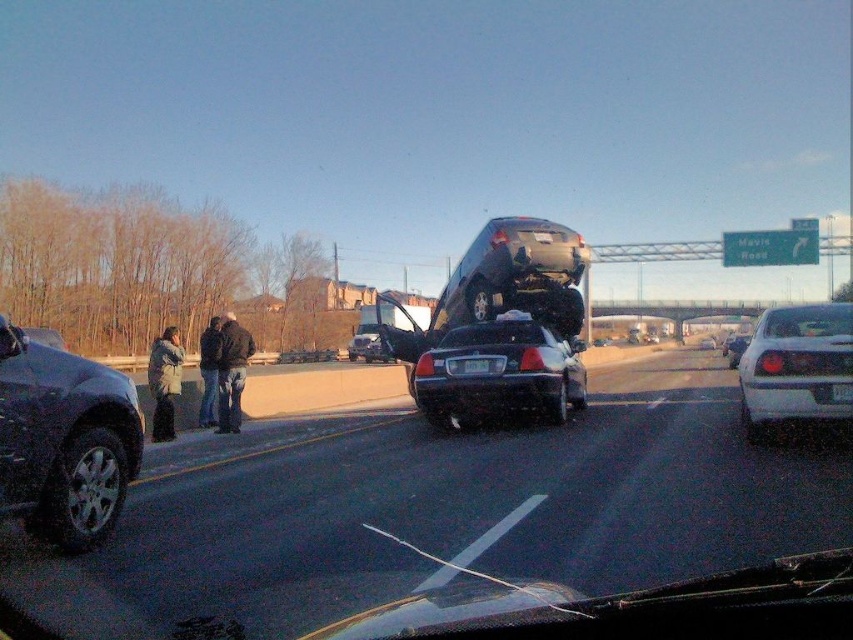
Question: Among these objects, which one is nearest to the camera?

Choices:
 (A) shiny black sedan at left
 (B) dark blue jeans at left
 (C) white glossy sedan at right
 (D) shiny black sedan at center

Answer: (A)

Question: Which object is the farthest from the shiny black sedan at left?

Choices:
 (A) glossy black sedan at center
 (B) white plastic license plate at center
 (C) dark blue jeans at left

Answer: (C)

Question: Can you confirm if dark blue jeans at left is positioned to the right of white plastic license plate at center?

Choices:
 (A) yes
 (B) no

Answer: (B)

Question: Which of the following is the farthest from the observer?

Choices:
 (A) (730, 369)
 (B) (50, 481)
 (C) (843, 394)

Answer: (A)

Question: Does shiny black car at center have a larger size compared to white plastic license plate at center?

Choices:
 (A) yes
 (B) no

Answer: (A)

Question: Can you confirm if dark blue jeans at left is positioned below shiny black sedan at center?

Choices:
 (A) no
 (B) yes

Answer: (A)